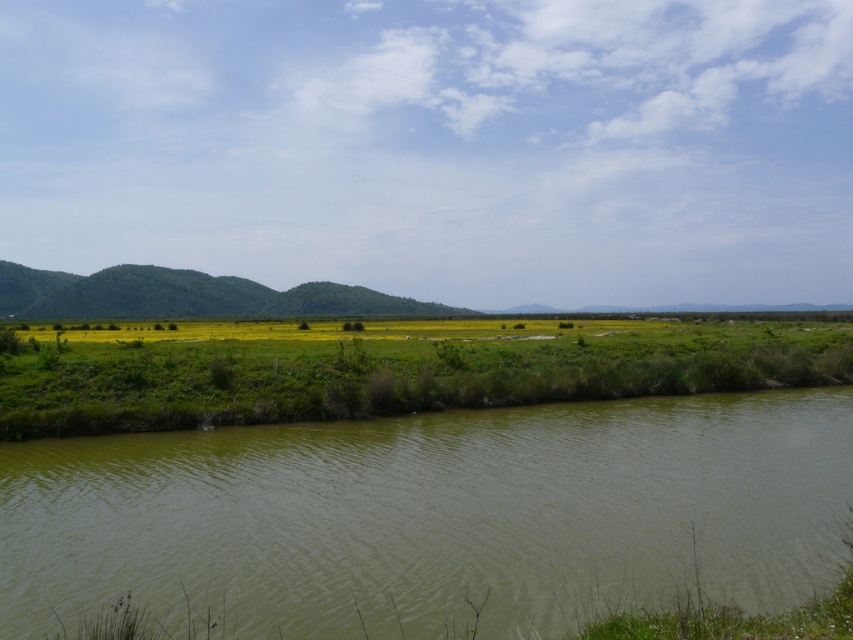
Question: Which object is positioned closest to the green grassy wetland at center?

Choices:
 (A) green grassy hill at center
 (B) green muddy water at lower left

Answer: (B)

Question: Does green grassy wetland at center have a lesser width compared to green grassy hill at center?

Choices:
 (A) no
 (B) yes

Answer: (B)

Question: Which point is closer to the camera?

Choices:
 (A) green grassy wetland at center
 (B) green grassy hill at center

Answer: (A)

Question: Which point is closer to the camera?

Choices:
 (A) green grassy hill at center
 (B) green grassy wetland at center

Answer: (B)

Question: Is green muddy water at lower left bigger than green grassy hill at center?

Choices:
 (A) yes
 (B) no

Answer: (B)

Question: Can you confirm if green grassy wetland at center is thinner than green grassy hill at center?

Choices:
 (A) no
 (B) yes

Answer: (B)